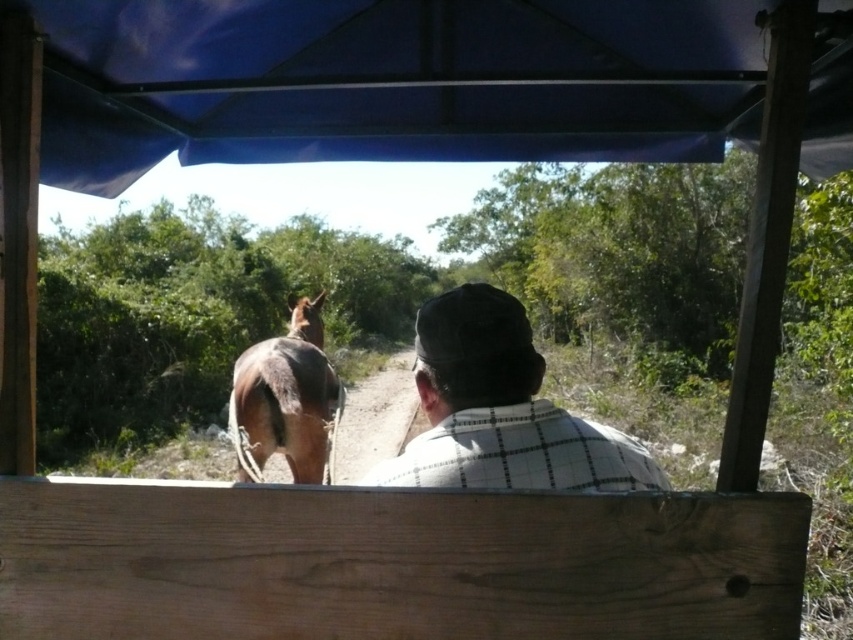
Based on the photo, does blue fabric canopy at upper center appear under white checkered shirt at center?

Actually, blue fabric canopy at upper center is above white checkered shirt at center.

Is point (664, 140) farther from camera compared to point (505, 344)?

Yes, it is behind point (505, 344).

Which is behind, point (844, 22) or point (631, 470)?

The point (844, 22) is behind.

Where is `blue fabric canopy at upper center`? blue fabric canopy at upper center is located at coordinates (392, 81).

Can you confirm if blue fabric canopy at upper center is wider than brown glossy horse at center?

Correct, the width of blue fabric canopy at upper center exceeds that of brown glossy horse at center.

Does point (303, 81) come behind point (228, 422)?

No.

Where is `blue fabric canopy at upper center`? This screenshot has height=640, width=853. blue fabric canopy at upper center is located at coordinates (392, 81).

Looking at this image, can you confirm if white checkered shirt at center is positioned above brown glossy horse at center?

Yes.

Is white checkered shirt at center taller than brown glossy horse at center?

No.

The width and height of the screenshot is (853, 640). I want to click on white checkered shirt at center, so click(502, 410).